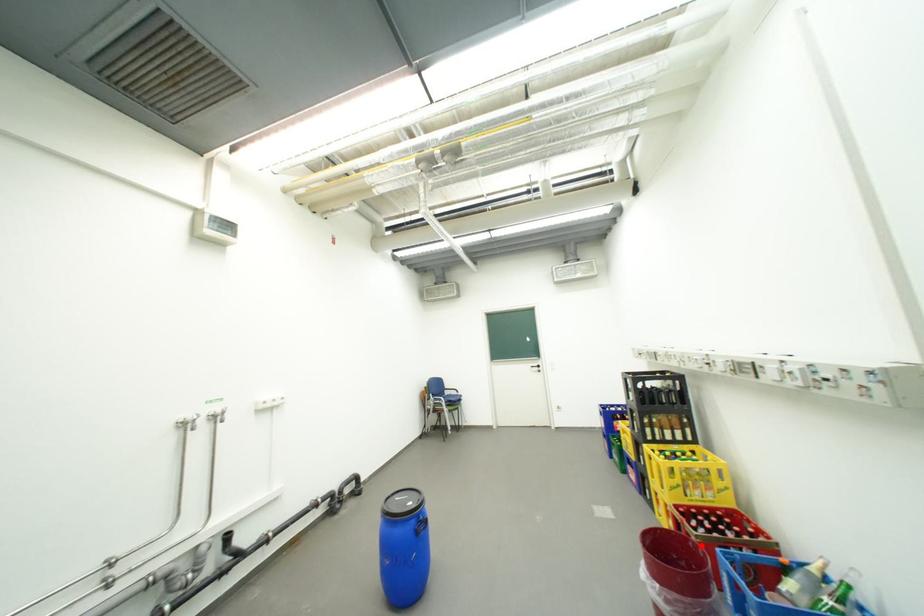
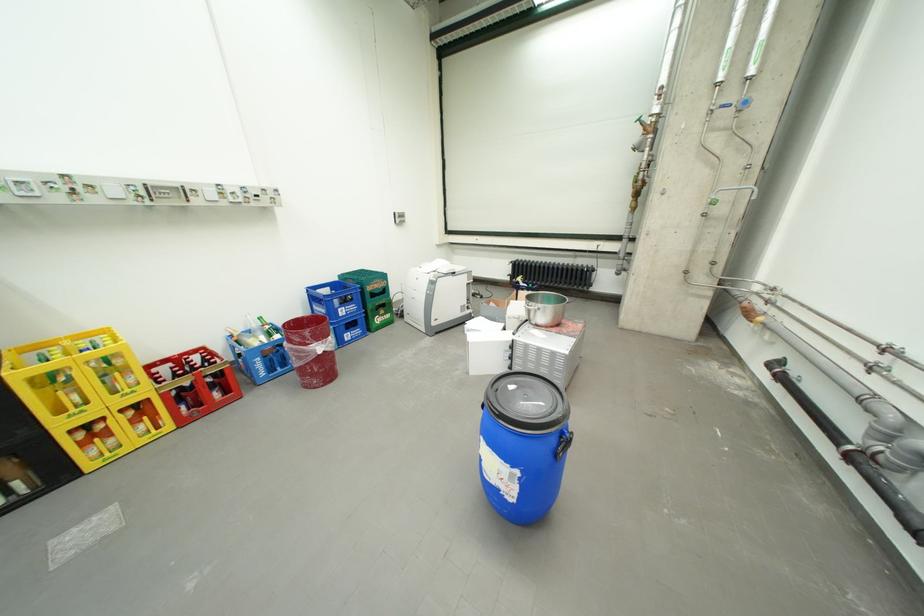
Question: I am providing you with two images of the same scene from different viewpoints. A red point is marked on the first image. At the location where the point appears in image 1, is it still visible in image 2?

Choices:
 (A) Yes
 (B) No

Answer: (A)